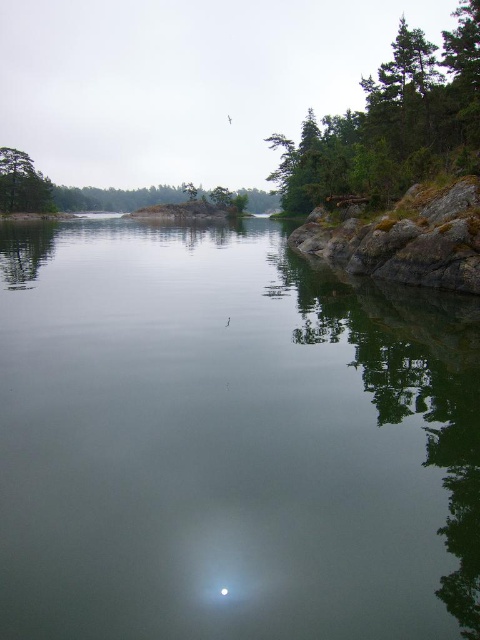
Question: Among these points, which one is farthest from the camera?

Choices:
 (A) (284, 148)
 (B) (316, 474)
 (C) (21, 157)

Answer: (C)

Question: Considering the relative positions of green leafy tree at upper right and green matte tree at left in the image provided, where is green leafy tree at upper right located with respect to green matte tree at left?

Choices:
 (A) left
 (B) right

Answer: (B)

Question: Is green leafy tree at upper right smaller than green matte tree at left?

Choices:
 (A) yes
 (B) no

Answer: (B)

Question: Estimate the real-world distances between objects in this image. Which object is farther from the green leafy tree at upper right?

Choices:
 (A) green matte tree at left
 (B) transparent water at center

Answer: (A)

Question: Is transparent water at center wider than green matte tree at left?

Choices:
 (A) yes
 (B) no

Answer: (A)

Question: Which of these objects is positioned farthest from the transparent water at center?

Choices:
 (A) green leafy tree at upper right
 (B) green matte tree at left

Answer: (B)